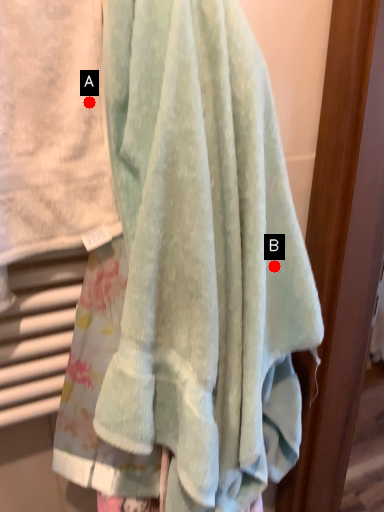
Question: Two points are circled on the image, labeled by A and B beside each circle. Which point is closer to the camera?

Choices:
 (A) A is closer
 (B) B is closer

Answer: (A)